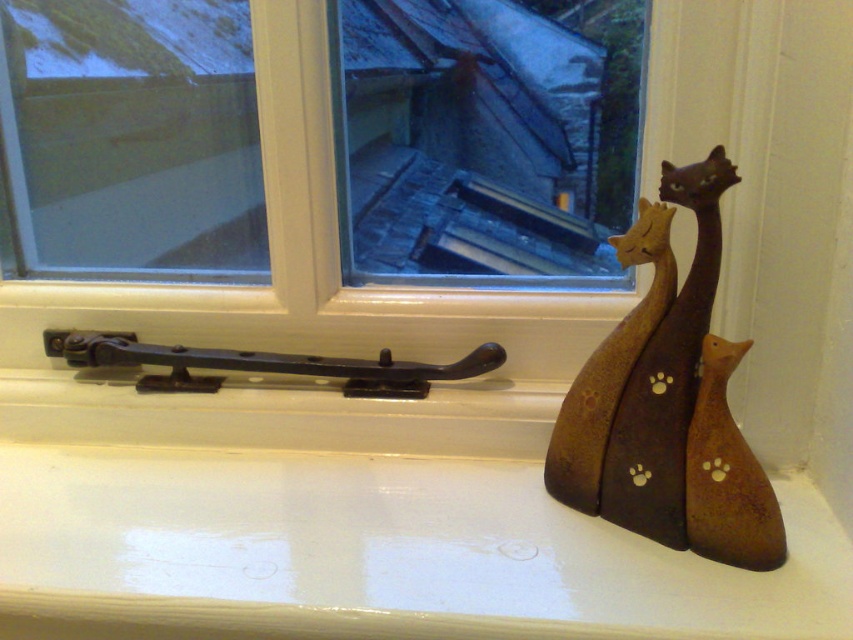
You are standing in front of the window and want to place a small potted plant on the white glossy window sill at lower right. Based on the coordinates provided, can you confirm if there is enough space for the plant?

The white glossy window sill at lower right is located at coordinates point (374, 554), but the description does not provide information about its size or available space. Therefore, it is uncertain if there is enough space for the plant.

You are a delivery robot trying to place a small package on the white glossy window sill at lower right. However, there is a brown matte wooden sculpture at right in the way. Can you place the package on the window sill without moving the sculpture?

The white glossy window sill at lower right is positioned under the brown matte wooden sculpture at right, so the sculpture is above the window sill. Therefore, you can place the package on the window sill without moving the sculpture as it is below the sculpture.